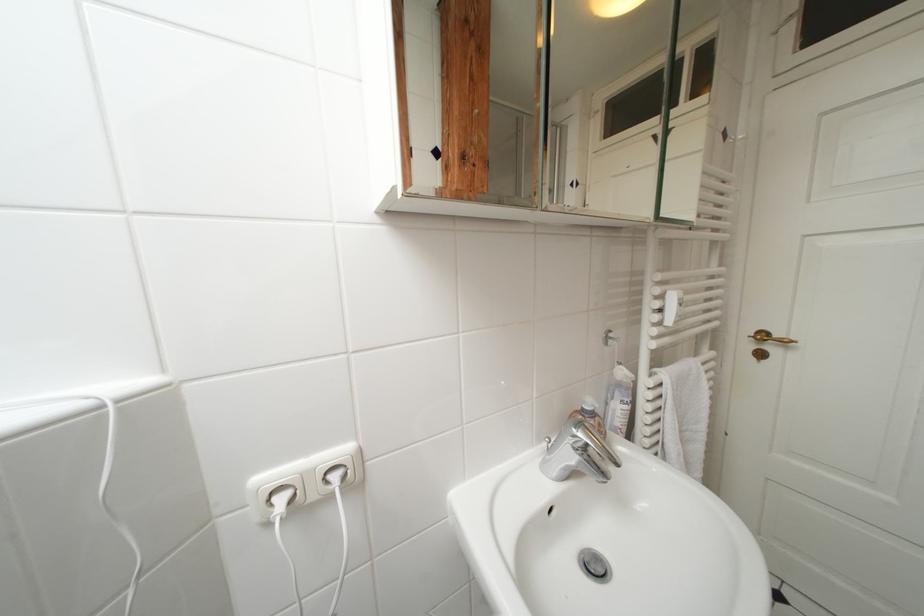
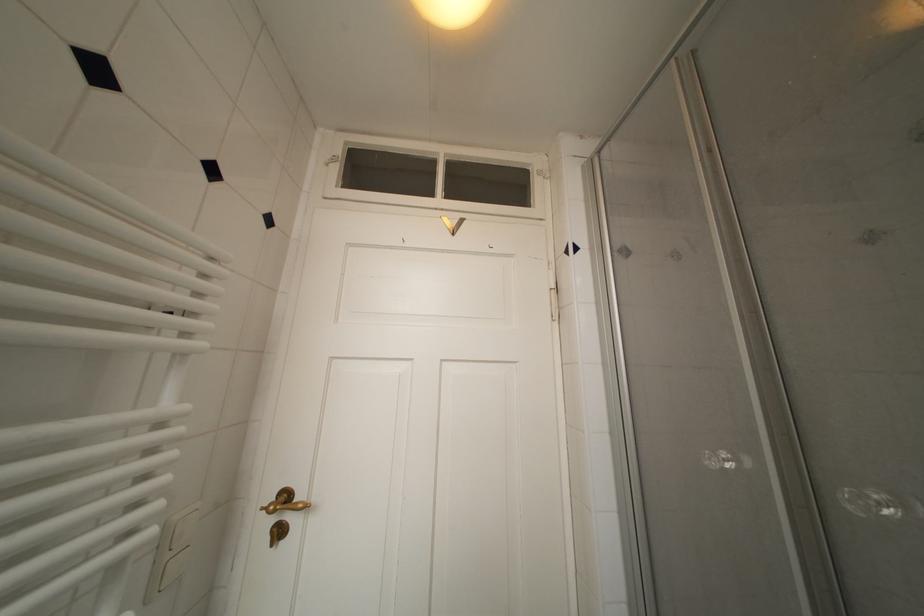
How did the camera likely rotate?

The camera rotated toward right-up.